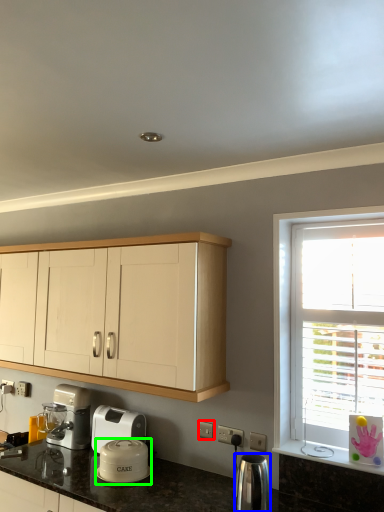
Question: Estimate the real-world distances between objects in this image. Which object is closer to electric outlet (highlighted by a red box), kitchen appliance (highlighted by a blue box) or kitchen appliance (highlighted by a green box)?

Choices:
 (A) kitchen appliance
 (B) kitchen appliance

Answer: (A)